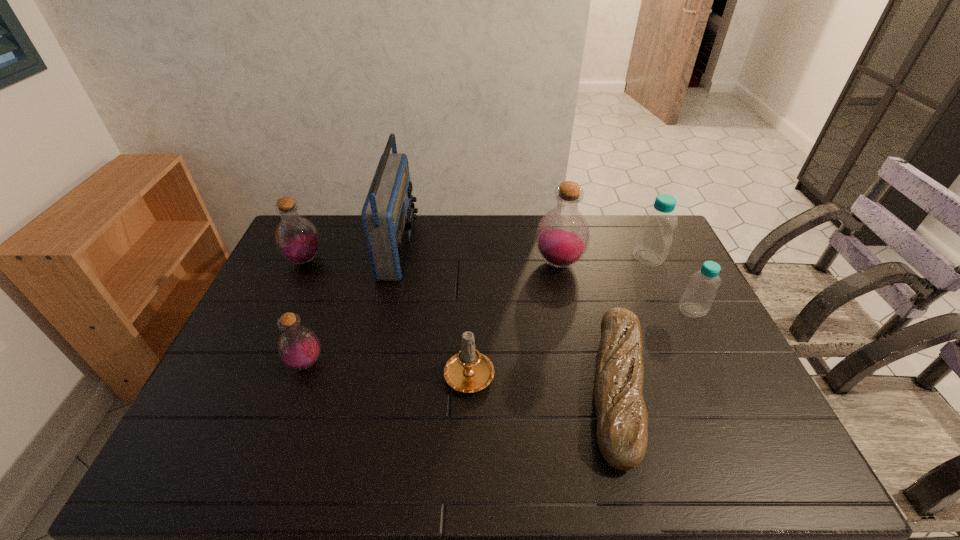
The image size is (960, 540). Find the location of `vacant space at the near right corner`. vacant space at the near right corner is located at coordinates (745, 457).

In order to click on free point between the nearest bottle and the biggest purple bottle in this screenshot , I will do `click(432, 313)`.

Identify the location of vacant region between the third bottle from right to left and the candle. This screenshot has width=960, height=540. (514, 317).

Locate an element on the screen. The height and width of the screenshot is (540, 960). free spot between the farther blue bottle and the candle is located at coordinates (559, 314).

Find the location of `free space between the biggest purple bottle and the third object from left to right`. free space between the biggest purple bottle and the third object from left to right is located at coordinates (479, 255).

In order to click on empty location between the fourth object from left to right and the fourth nearest object in this screenshot , I will do `click(581, 341)`.

Locate an element on the screen. Image resolution: width=960 pixels, height=540 pixels. empty location between the fifth object from right to left and the rightmost purple bottle is located at coordinates pyautogui.click(x=514, y=317).

This screenshot has height=540, width=960. Find the location of `empty space that is in between the fourth object from left to right and the sixth object from right to left`. empty space that is in between the fourth object from left to right and the sixth object from right to left is located at coordinates (434, 309).

Identify the location of vacant area that lies between the biggest purple bottle and the farther blue bottle. (603, 260).

You are a GUI agent. You are given a task and a screenshot of the screen. Output one action in this format:
    pyautogui.click(x=<x>, y=<y>)
    Task: Click on the unoccupied area between the fourth object from left to right and the biggest purple bottle
    
    Given the screenshot: What is the action you would take?
    pyautogui.click(x=514, y=317)